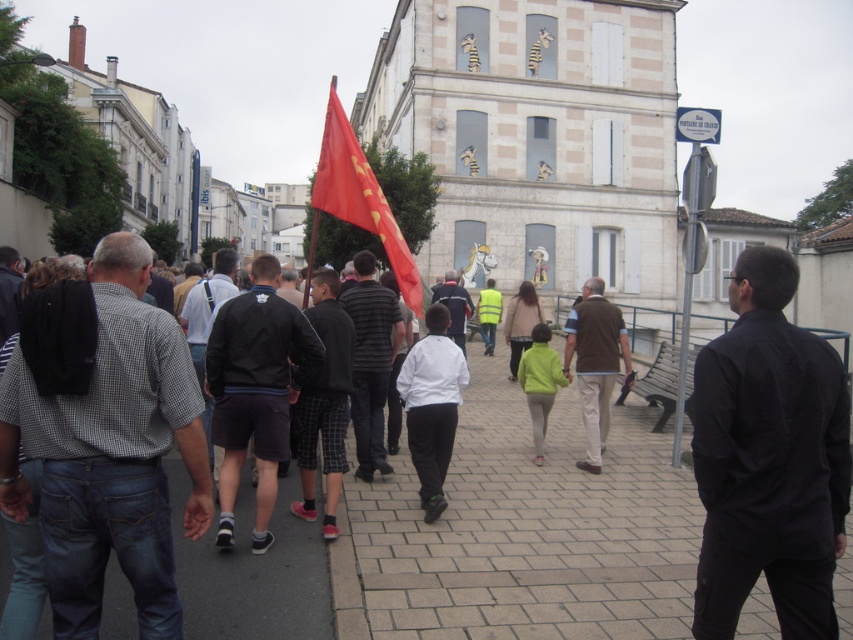
Question: Based on their relative distances, which object is nearer to the red fabric flag at center?

Choices:
 (A) checkered fabric shirt at left
 (B) black cotton shirt at center
 (C) white matte jacket at center

Answer: (B)

Question: Does matte black jacket at center come behind high visibility yellow jacket at center?

Choices:
 (A) yes
 (B) no

Answer: (B)

Question: Which point is closer to the camera?

Choices:
 (A) (700, 620)
 (B) (132, 547)
 (C) (389, 225)
 (D) (589, 323)

Answer: (B)

Question: Does black cotton shirt at center appear under black matte jacket at center?

Choices:
 (A) no
 (B) yes

Answer: (B)

Question: Is red fabric flag at center to the right of brown suede vest at center from the viewer's perspective?

Choices:
 (A) yes
 (B) no

Answer: (B)

Question: Among these points, which one is farthest from the camera?

Choices:
 (A) (173, 396)
 (B) (421, 416)

Answer: (B)